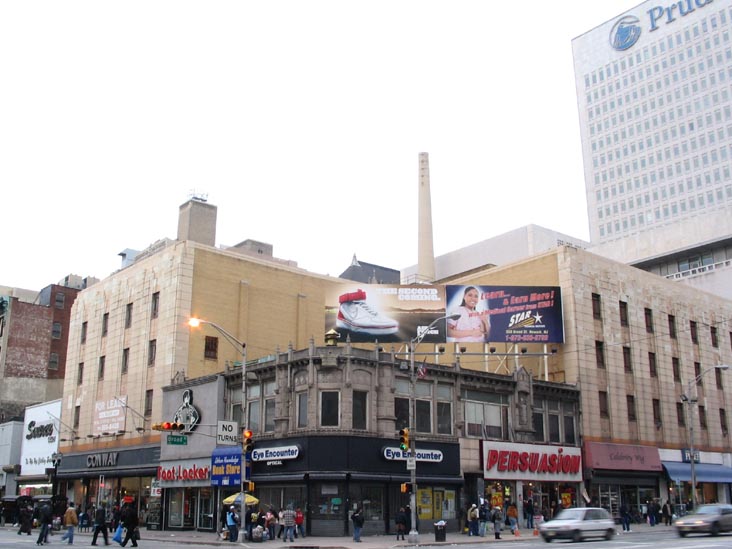
Where is `black rubbish bin/ trashcan`? This screenshot has width=732, height=549. black rubbish bin/ trashcan is located at coordinates (438, 531).